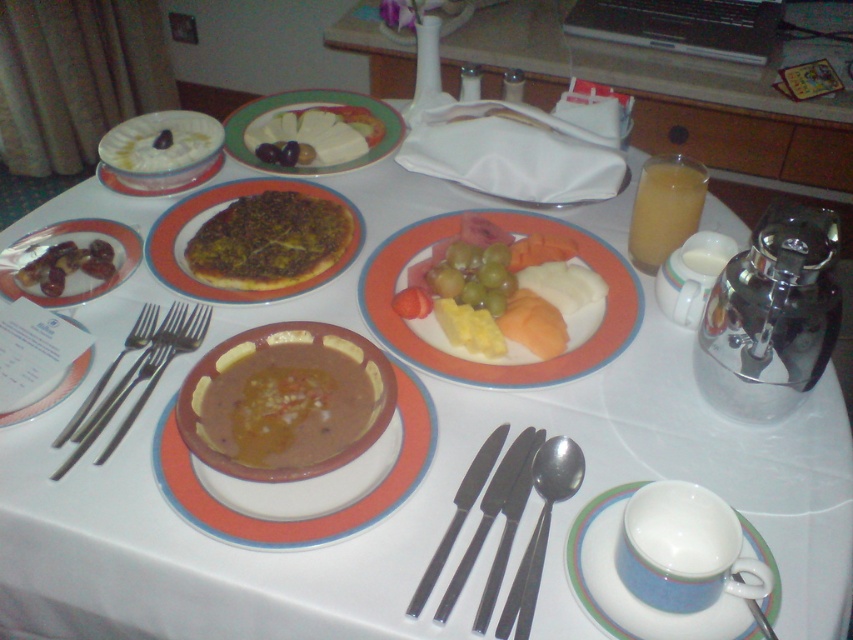
You are a guest at this breakfast table and want to reach both the white smooth cheese at center and the white creamy dessert at upper left. Which one is closer to your right hand if you are sitting facing the table?

The white smooth cheese at center is positioned on the right side of white creamy dessert at upper left, so if you are sitting facing the table, the white smooth cheese at center will be closer to your right hand.

You are a guest at this breakfast table. You want to reach for the white creamy dessert at upper left but need to avoid knocking over the white ceramic plate at upper left. Based on their positions, is the dessert above or below the plate?

The white creamy dessert at upper left is located above the white ceramic plate at upper left, so it is positioned above the plate.

In the scene shown: You are sitting at the table and want to reach for the item located at point (260, 161). However, there is an obstruction at point (161, 161). Can you reach the item without moving the obstruction?

Point (260, 161) is behind point (161, 161), so you cannot reach it without moving the obstruction at point (161, 161).